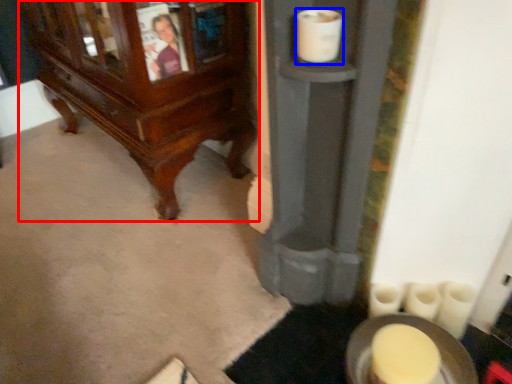
Question: Which object appears closest to the camera in this image, furniture (highlighted by a red box) or toilet paper (highlighted by a blue box)?

Choices:
 (A) furniture
 (B) toilet paper

Answer: (B)